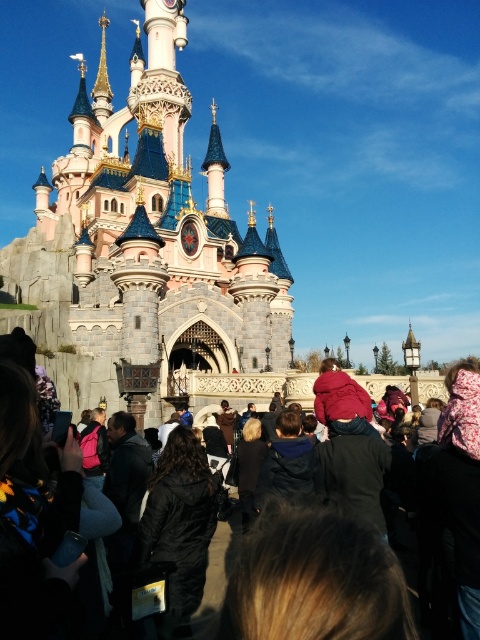
Can you confirm if pink stone castle at center is taller than black matte coat at center?

Yes, pink stone castle at center is taller than black matte coat at center.

Does pink stone castle at center appear over black matte coat at center?

Yes.

Is point (202, 390) behind point (189, 483)?

That is True.

Find the location of a particular element. This screenshot has height=640, width=480. pink stone castle at center is located at coordinates (149, 246).

Is black fabric crowd at center below dark blue jacket at center?

Actually, black fabric crowd at center is above dark blue jacket at center.

Is black fabric crowd at center smaller than dark blue jacket at center?

Incorrect, black fabric crowd at center is not smaller in size than dark blue jacket at center.

Which is behind, point (297, 422) or point (288, 419)?

Positioned behind is point (288, 419).

Where is `black fabric crowd at center`? Image resolution: width=480 pixels, height=640 pixels. black fabric crowd at center is located at coordinates (360, 468).

Is pink stone castle at center in front of black fabric crowd at center?

No, it is behind black fabric crowd at center.

Locate an element on the screen. The height and width of the screenshot is (640, 480). pink stone castle at center is located at coordinates (149, 246).

Locate an element on the screen. The width and height of the screenshot is (480, 640). pink stone castle at center is located at coordinates (149, 246).